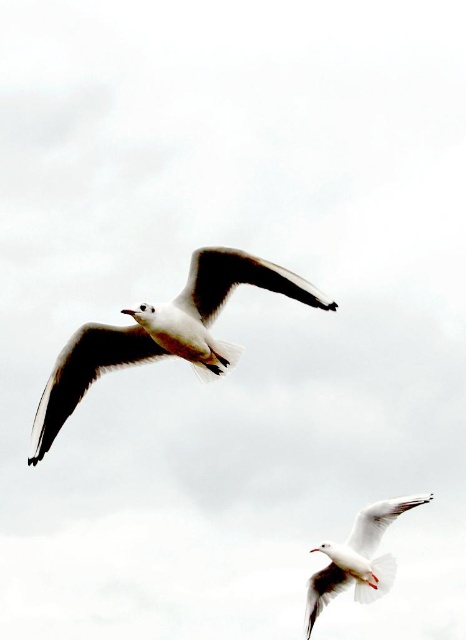
You are a birdwatcher observing two white feathered birds in the sky. You see the white feathered bird at upper center and the white feathered bird at lower right. Which one is flying higher in the sky?

The white feathered bird at upper center is flying higher in the sky than the white feathered bird at lower right because it is positioned above it in the frame.

You are a birdwatcher observing two seagulls in the sky. You see the white feathered bird at upper center and the white feathered bird at lower right. Which one do you think has a larger wingspan based on their positions in the image?

The white feathered bird at upper center might be wider than the white feathered bird at lower right, so it could have a larger wingspan.

You are a birdwatcher trying to identify two seagulls in the sky. You notice both the white feathered bird at upper center and the white feathered bird at lower right. Which one appears larger in size?

The white feathered bird at upper center appears larger than the white feathered bird at lower right.